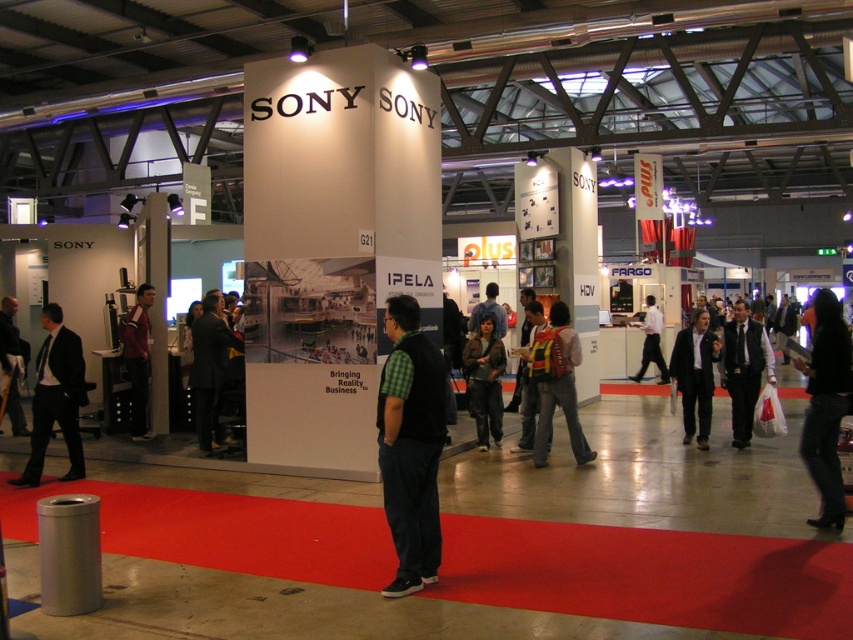
You are standing at the entrance of the exhibition hall and see two points marked in the image. The first point is at coordinates point (693,340) and the second point is at point (142,362). Which point is closer to you?

Point (693,340) is in front of point (142,362), so the first point is closer to you.

You are standing at the entrance of the exhibition hall and see the Sony booth with its large display. There is a point marked at coordinates (695, 374). What object is located at that point?

→ The black suit at center is located at point (695, 374).